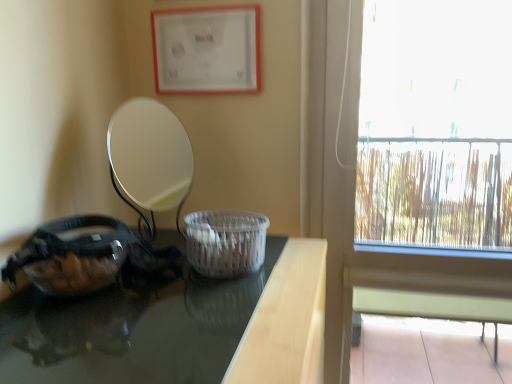
Question: From a real-world perspective, is black glossy table at left on top of transparent glass bowl at left?

Choices:
 (A) yes
 (B) no

Answer: (B)

Question: Is transparent glass bowl at left located within black glossy table at left?

Choices:
 (A) yes
 (B) no

Answer: (B)

Question: Is black glossy table at left next to transparent glass bowl at left and touching it?

Choices:
 (A) no
 (B) yes

Answer: (A)

Question: Can you confirm if black glossy table at left is shorter than transparent glass bowl at left?

Choices:
 (A) no
 (B) yes

Answer: (A)

Question: Considering the relative positions of black glossy table at left and transparent glass bowl at left in the image provided, is black glossy table at left behind transparent glass bowl at left?

Choices:
 (A) no
 (B) yes

Answer: (A)

Question: Is black glossy table at left facing away from transparent glass bowl at left?

Choices:
 (A) yes
 (B) no

Answer: (B)

Question: Does matte white picture frame at upper center have a greater width compared to transparent glass window at right?

Choices:
 (A) yes
 (B) no

Answer: (B)

Question: Is matte white picture frame at upper center in contact with transparent glass window at right?

Choices:
 (A) yes
 (B) no

Answer: (B)

Question: Is matte white picture frame at upper center taller than transparent glass window at right?

Choices:
 (A) no
 (B) yes

Answer: (A)

Question: From the image's perspective, does matte white picture frame at upper center appear lower than transparent glass window at right?

Choices:
 (A) no
 (B) yes

Answer: (A)

Question: Is matte white picture frame at upper center smaller than transparent glass window at right?

Choices:
 (A) yes
 (B) no

Answer: (A)

Question: Considering the relative positions of matte white picture frame at upper center and transparent glass window at right in the image provided, is matte white picture frame at upper center to the right of transparent glass window at right from the viewer's perspective?

Choices:
 (A) no
 (B) yes

Answer: (A)

Question: Considering the relative positions of transparent glass window at right and white woven basket at center in the image provided, is transparent glass window at right to the right of white woven basket at center from the viewer's perspective?

Choices:
 (A) no
 (B) yes

Answer: (B)